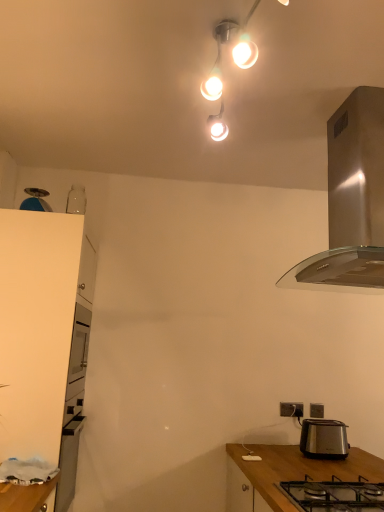
Question: Is satin silver toaster at lower right located outside black metal/glass gas stove at lower center?

Choices:
 (A) yes
 (B) no

Answer: (A)

Question: Can you see satin silver toaster at lower right touching black metal/glass gas stove at lower center?

Choices:
 (A) yes
 (B) no

Answer: (B)

Question: Would you say satin silver toaster at lower right contains black metal/glass gas stove at lower center?

Choices:
 (A) yes
 (B) no

Answer: (B)

Question: Does satin silver toaster at lower right turn towards black metal/glass gas stove at lower center?

Choices:
 (A) yes
 (B) no

Answer: (A)

Question: From a real-world perspective, is satin silver toaster at lower right physically above black metal/glass gas stove at lower center?

Choices:
 (A) yes
 (B) no

Answer: (A)

Question: From the image's perspective, is satin silver toaster at lower right over black metal/glass gas stove at lower center?

Choices:
 (A) no
 (B) yes

Answer: (A)

Question: Is satin silver toaster at lower right positioned with its back to matte black power outlet at lower right, acting as the 2th power outlet starting from the left?

Choices:
 (A) no
 (B) yes

Answer: (B)

Question: Is satin silver toaster at lower right positioned before matte black power outlet at lower right, which is the 1th power outlet from right to left?

Choices:
 (A) yes
 (B) no

Answer: (A)

Question: Does satin silver toaster at lower right contain matte black power outlet at lower right, acting as the 2th power outlet starting from the left?

Choices:
 (A) yes
 (B) no

Answer: (B)

Question: Does satin silver toaster at lower right have a larger size compared to matte black power outlet at lower right, acting as the 2th power outlet starting from the left?

Choices:
 (A) no
 (B) yes

Answer: (B)

Question: From a real-world perspective, is satin silver toaster at lower right positioned under matte black power outlet at lower right, acting as the 2th power outlet starting from the left, based on gravity?

Choices:
 (A) no
 (B) yes

Answer: (B)

Question: Is satin silver toaster at lower right not inside matte black power outlet at lower right, acting as the 2th power outlet starting from the left?

Choices:
 (A) no
 (B) yes

Answer: (B)

Question: Does matte white light fixture at upper center touch matte black power outlet at lower right, acting as the 2th power outlet starting from the left?

Choices:
 (A) no
 (B) yes

Answer: (A)